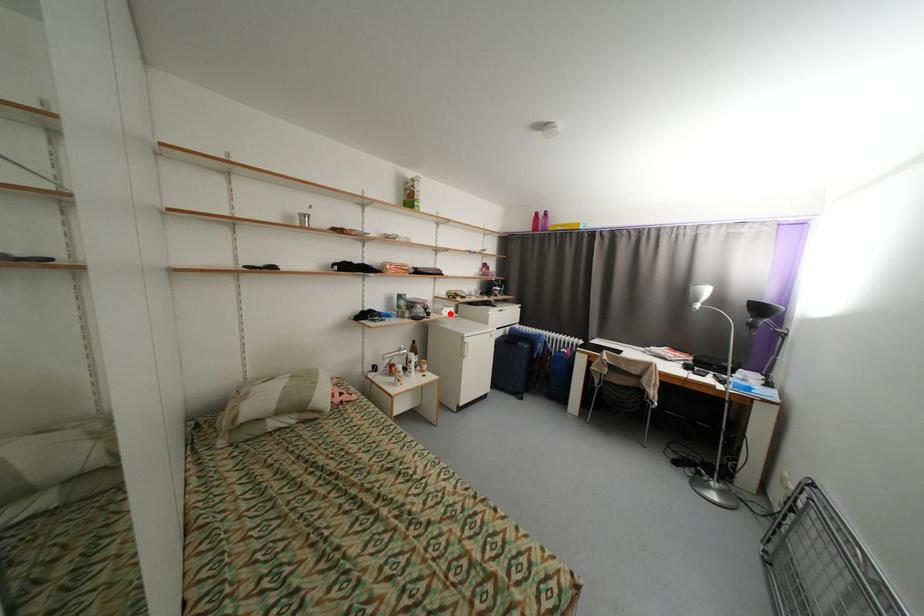
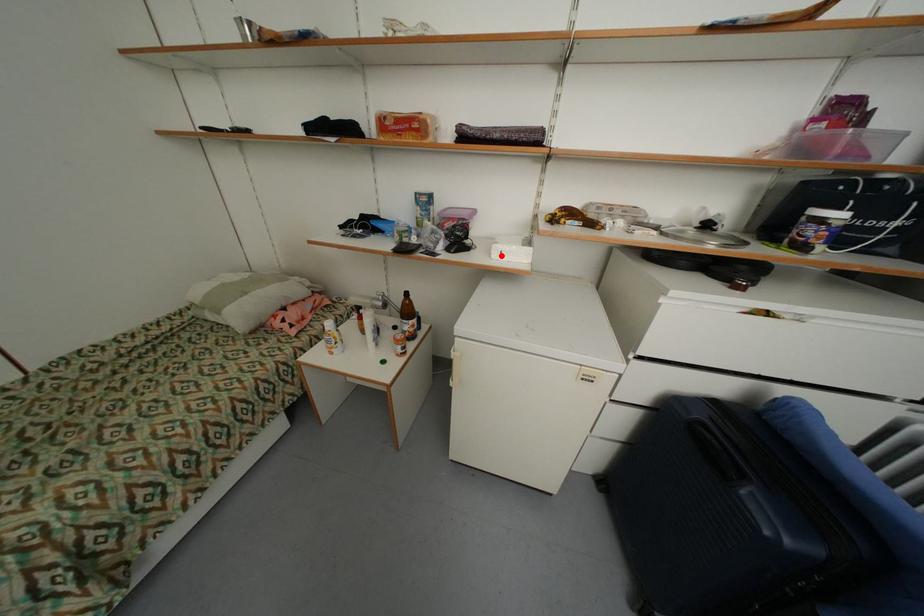
I am providing you with two images of the same scene from different viewpoints. A red point is marked on the first image and another point is marked on the second image. Is the red point in image1 aligned with the point shown in image2?

Yes